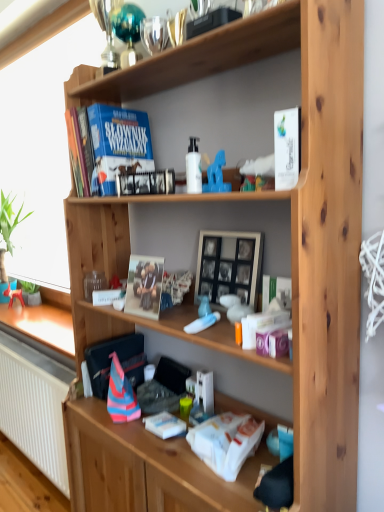
Question: From a real-world perspective, is green matte plant at lower left positioned above or below matte cardboard photo frame at center, which is the 2th paperback book from back to front?

Choices:
 (A) above
 (B) below

Answer: (B)

Question: From the image's perspective, is green matte plant at lower left located above or below matte cardboard photo frame at center, the second paperback book from the left?

Choices:
 (A) above
 (B) below

Answer: (B)

Question: Considering the real-world distances, which object is farthest from the white glossy paperback book at upper right, positioned as the first paperback book in right-to-left order?

Choices:
 (A) white glossy bottle at center
 (B) wooden picture frame at center
 (C) green matte plant at lower left
 (D) hardcover book at upper center, placed as the third paperback book when sorted from right to left
 (E) matte cardboard photo frame at center, the second paperback book positioned from the front

Answer: (C)

Question: Which object is positioned closest to the white glossy paperback book at upper right, the second paperback book in the top-to-bottom sequence?

Choices:
 (A) white glossy bottle at center
 (B) green matte plant at lower left
 (C) translucent plastic container at middle
 (D) wooden picture frame at center
 (E) matte cardboard photo frame at center, the second paperback book positioned from the front

Answer: (A)